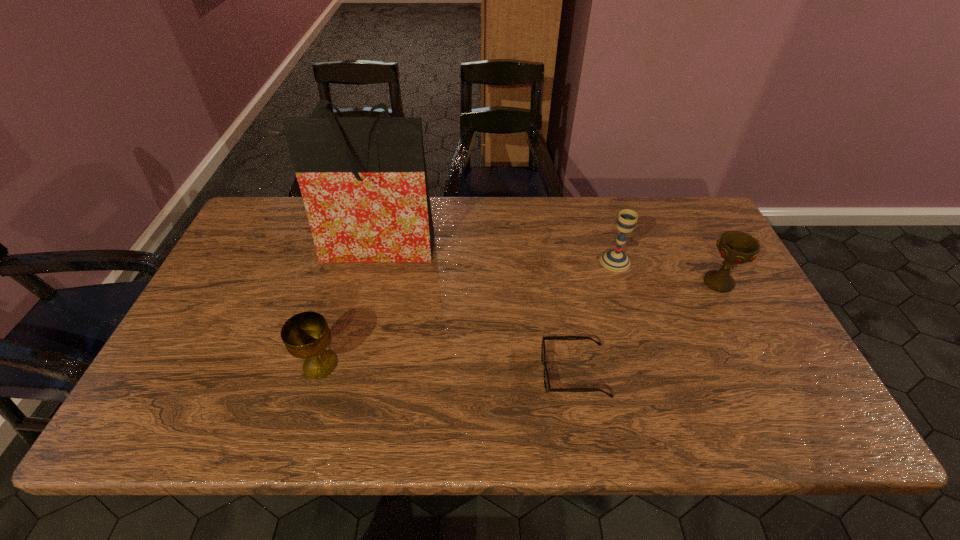
Where is `shopping bag`? This screenshot has height=540, width=960. shopping bag is located at coordinates coord(363,180).

Identify the location of the second chalice from right to left. Image resolution: width=960 pixels, height=540 pixels. (615, 260).

This screenshot has height=540, width=960. Identify the location of the rightmost chalice. (735, 247).

At what (x,y) coordinates should I click in order to perform the action: click on the leftmost chalice. Please return your answer as a coordinate pair (x, y). Image resolution: width=960 pixels, height=540 pixels. Looking at the image, I should click on (306, 335).

Locate an element on the screen. the shortest object is located at coordinates (548, 389).

The width and height of the screenshot is (960, 540). I want to click on sunglasses, so click(548, 389).

What are the coordinates of `vacant space located on the front side of the tallest object` in the screenshot? It's located at (348, 338).

Find the location of `vacant point located 0.240m on the left of the second chalice from right to left`. vacant point located 0.240m on the left of the second chalice from right to left is located at coordinates (518, 261).

At what (x,y) coordinates should I click in order to perform the action: click on free spot located 0.120m on the front of the rightmost chalice. Please return your answer as a coordinate pair (x, y). This screenshot has height=540, width=960. Looking at the image, I should click on pos(744,331).

The width and height of the screenshot is (960, 540). In order to click on vacant space located on the front of the nearest chalice in this screenshot , I will do `click(301, 429)`.